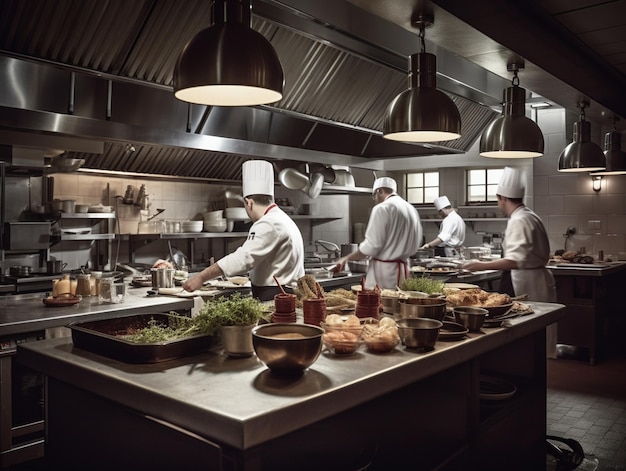
The height and width of the screenshot is (471, 626). Find the location of `steel light fixtures`. steel light fixtures is located at coordinates (254, 59), (424, 110), (513, 131), (615, 160), (581, 154).